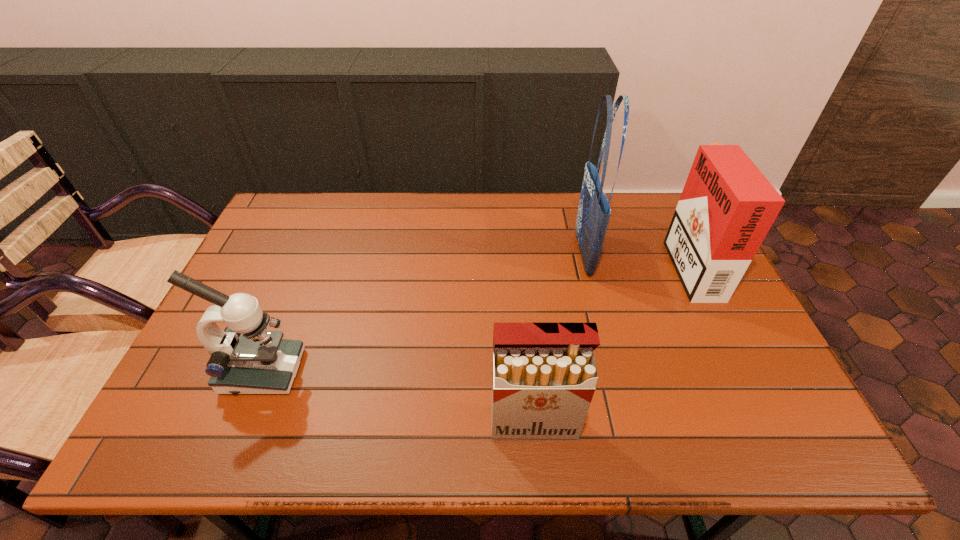
This screenshot has width=960, height=540. I want to click on shopping bag, so click(594, 211).

Locate an element on the screen. The height and width of the screenshot is (540, 960). the tallest object is located at coordinates (594, 211).

Find the location of a particular element. the farther cigarette case is located at coordinates (727, 206).

Where is `the rightmost object`? Image resolution: width=960 pixels, height=540 pixels. the rightmost object is located at coordinates (727, 206).

The image size is (960, 540). In order to click on the leftmost object in this screenshot , I will do pos(245,358).

Identify the location of microscope. (245, 358).

Image resolution: width=960 pixels, height=540 pixels. In order to click on the nearer cigarette case in this screenshot , I will do `click(544, 374)`.

This screenshot has height=540, width=960. What are the coordinates of `the second object from left to right` in the screenshot? It's located at (544, 374).

Find the location of `free region located on the front-facing side of the third object from left to right`. free region located on the front-facing side of the third object from left to right is located at coordinates tap(468, 254).

The height and width of the screenshot is (540, 960). In order to click on free space located 0.070m on the front-facing side of the third object from left to right in this screenshot , I will do `click(552, 254)`.